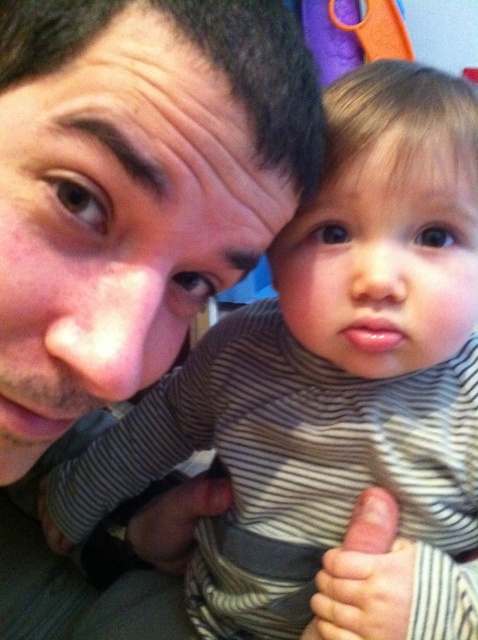
Based on the scene description, if you were to draw a horizontal line across the image, would the matte gray thumb at center be positioned above or below the matte skin face at upper left?

The matte skin face at upper left is taller than the matte gray thumb at center, so the matte gray thumb at center would be positioned below the matte skin face at upper left.

You are a photographer trying to capture a closeup shot of the matte skin face at upper left and the matte gray thumb at center. Which object should you focus on first if you want to ensure both are in focus, considering their sizes?

The matte skin face at upper left is larger in size than the matte gray thumb at center, so you should focus on the matte skin face at upper left first to ensure both are in focus.

You are standing in the scene and want to place a sticker on the point that is closer to you. Which point should you choose between point (0, 356) and point (354, 604)?

Point (0, 356) is in front of point (354, 604), so you should choose point (0, 356) to place the sticker closer to you.